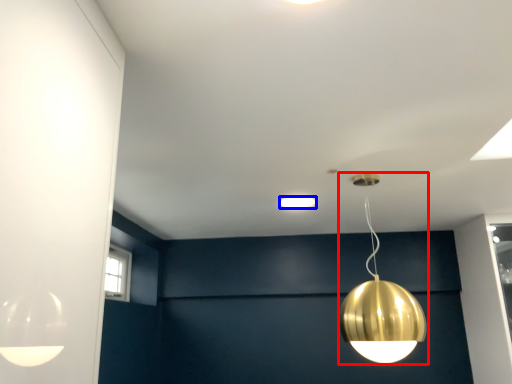
Question: Among these objects, which one is nearest to the camera, lamp (highlighted by a red box) or lamp (highlighted by a blue box)?

Choices:
 (A) lamp
 (B) lamp

Answer: (A)